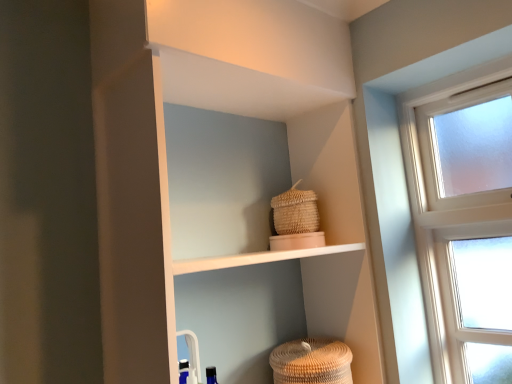
Identify the location of woven straw basket at upper center, the first basket viewed from the top. The height and width of the screenshot is (384, 512). (295, 211).

What is the approximate height of white matte shelf at upper center?

The height of white matte shelf at upper center is 36.72 inches.

In order to face white matte shelf at upper center, should I rotate leftwards or rightwards?

To face it directly, rotate left by 0.418 degrees.

Locate an element on the screen. The width and height of the screenshot is (512, 384). woven straw basket at upper center, the first basket viewed from the top is located at coordinates (295, 211).

Is white matte shelf at upper center at the back of woven straw basket at upper center, the first basket viewed from the top?

Correct, woven straw basket at upper center, the first basket viewed from the top, is looking away from white matte shelf at upper center.

Is point (275, 202) positioned in front of point (166, 75)?

No, (275, 202) is further to viewer.

From a real-world perspective, is woven straw basket at upper center, which ranks as the 2th basket in bottom-to-top order, on top of white matte shelf at upper center?

Yes, from a real-world perspective, woven straw basket at upper center, which ranks as the 2th basket in bottom-to-top order, is on top of white matte shelf at upper center.

How distant is woven straw basket at upper center, which ranks as the 2th basket in bottom-to-top order, from white matte shelf at upper center?

15.73 inches.

From the picture: Between brown woven basket at lower center, the first basket when ordered from bottom to top, and woven straw basket at upper center, the first basket viewed from the top, which one has larger size?

brown woven basket at lower center, the first basket when ordered from bottom to top.

Can you see brown woven basket at lower center, which is counted as the 2th basket, starting from the top, touching woven straw basket at upper center, the first basket viewed from the top?

They are not placed beside each other.

Considering the relative positions of brown woven basket at lower center, which is counted as the 2th basket, starting from the top, and woven straw basket at upper center, which ranks as the 2th basket in bottom-to-top order, in the image provided, is brown woven basket at lower center, which is counted as the 2th basket, starting from the top, to the left of woven straw basket at upper center, which ranks as the 2th basket in bottom-to-top order, from the viewer's perspective?

No, brown woven basket at lower center, which is counted as the 2th basket, starting from the top, is not to the left of woven straw basket at upper center, which ranks as the 2th basket in bottom-to-top order.

Can you confirm if brown woven basket at lower center, which is counted as the 2th basket, starting from the top, is thinner than woven straw basket at upper center, the first basket viewed from the top?

Incorrect, the width of brown woven basket at lower center, which is counted as the 2th basket, starting from the top, is not less than that of woven straw basket at upper center, the first basket viewed from the top.

Which is more to the left, woven straw basket at upper center, which ranks as the 2th basket in bottom-to-top order, or brown woven basket at lower center, which is counted as the 2th basket, starting from the top?

Positioned to the left is woven straw basket at upper center, which ranks as the 2th basket in bottom-to-top order.

From the image's perspective, is woven straw basket at upper center, the first basket viewed from the top, above or below brown woven basket at lower center, the first basket when ordered from bottom to top?

woven straw basket at upper center, the first basket viewed from the top, is above brown woven basket at lower center, the first basket when ordered from bottom to top.

Where is `basket lying on the right of woven straw basket at upper center, the first basket viewed from the top`? basket lying on the right of woven straw basket at upper center, the first basket viewed from the top is located at coordinates [311, 362].

Is white matte shelf at upper center to the left of brown woven basket at lower center, the first basket when ordered from bottom to top, from the viewer's perspective?

Indeed, white matte shelf at upper center is positioned on the left side of brown woven basket at lower center, the first basket when ordered from bottom to top.

From the image's perspective, which one is positioned higher, white matte shelf at upper center or brown woven basket at lower center, the first basket when ordered from bottom to top?

white matte shelf at upper center, from the image's perspective.

Based on the photo, is white matte shelf at upper center further to camera compared to brown woven basket at lower center, the first basket when ordered from bottom to top?

No, it is not.

Does point (379, 374) appear closer or farther from the camera than point (303, 366)?

Point (379, 374) is positioned farther from the camera compared to point (303, 366).

Are brown woven basket at lower center, the first basket when ordered from bottom to top, and white matte shelf at upper center beside each other?

There is a gap between brown woven basket at lower center, the first basket when ordered from bottom to top, and white matte shelf at upper center.

Is brown woven basket at lower center, the first basket when ordered from bottom to top, looking in the opposite direction of white matte shelf at upper center?

That's right, brown woven basket at lower center, the first basket when ordered from bottom to top, is facing away from white matte shelf at upper center.

Considering the relative sizes of brown woven basket at lower center, the first basket when ordered from bottom to top, and white matte shelf at upper center in the image provided, is brown woven basket at lower center, the first basket when ordered from bottom to top, taller than white matte shelf at upper center?

No.

Is white matte shelf at upper center at the right side of woven straw basket at upper center, which ranks as the 2th basket in bottom-to-top order?

In fact, white matte shelf at upper center is to the left of woven straw basket at upper center, which ranks as the 2th basket in bottom-to-top order.

Can you tell me how much white matte shelf at upper center and woven straw basket at upper center, which ranks as the 2th basket in bottom-to-top order, differ in facing direction?

The angle between the facing direction of white matte shelf at upper center and the facing direction of woven straw basket at upper center, which ranks as the 2th basket in bottom-to-top order, is 1.49 degrees.

Locate an element on the screen. basket above the white matte shelf at upper center (from a real-world perspective) is located at coordinates (295, 211).

Is white matte shelf at upper center positioned beyond the bounds of woven straw basket at upper center, which ranks as the 2th basket in bottom-to-top order?

That's correct, white matte shelf at upper center is outside of woven straw basket at upper center, which ranks as the 2th basket in bottom-to-top order.

Locate an element on the screen. The height and width of the screenshot is (384, 512). basket above the white matte shelf at upper center (from a real-world perspective) is located at coordinates (295, 211).

This screenshot has height=384, width=512. I want to click on basket below the woven straw basket at upper center, which ranks as the 2th basket in bottom-to-top order (from the image's perspective), so [x=311, y=362].

Considering their positions, is woven straw basket at upper center, which ranks as the 2th basket in bottom-to-top order, positioned further to brown woven basket at lower center, the first basket when ordered from bottom to top, than white matte shelf at upper center?

Based on the image, white matte shelf at upper center appears to be further to brown woven basket at lower center, the first basket when ordered from bottom to top.

Which object lies further to the anchor point white matte shelf at upper center, brown woven basket at lower center, the first basket when ordered from bottom to top, or woven straw basket at upper center, which ranks as the 2th basket in bottom-to-top order?

brown woven basket at lower center, the first basket when ordered from bottom to top, is positioned further to the anchor white matte shelf at upper center.

When comparing their distances from white matte shelf at upper center, does woven straw basket at upper center, the first basket viewed from the top, or brown woven basket at lower center, which is counted as the 2th basket, starting from the top, seem further?

brown woven basket at lower center, which is counted as the 2th basket, starting from the top, is positioned further to the anchor white matte shelf at upper center.

Considering their positions, is white matte shelf at upper center positioned closer to woven straw basket at upper center, the first basket viewed from the top, than brown woven basket at lower center, the first basket when ordered from bottom to top?

Among the two, brown woven basket at lower center, the first basket when ordered from bottom to top, is located nearer to woven straw basket at upper center, the first basket viewed from the top.

Considering their positions, is white matte shelf at upper center positioned further to brown woven basket at lower center, which is counted as the 2th basket, starting from the top, than woven straw basket at upper center, which ranks as the 2th basket in bottom-to-top order?

The object further to brown woven basket at lower center, which is counted as the 2th basket, starting from the top, is white matte shelf at upper center.

Based on their spatial positions, is brown woven basket at lower center, the first basket when ordered from bottom to top, or white matte shelf at upper center closer to woven straw basket at upper center, which ranks as the 2th basket in bottom-to-top order?

brown woven basket at lower center, the first basket when ordered from bottom to top, is positioned closer to the anchor woven straw basket at upper center, which ranks as the 2th basket in bottom-to-top order.

Identify the location of basket between white matte shelf at upper center and woven straw basket at upper center, which ranks as the 2th basket in bottom-to-top order, from front to back. (311, 362).